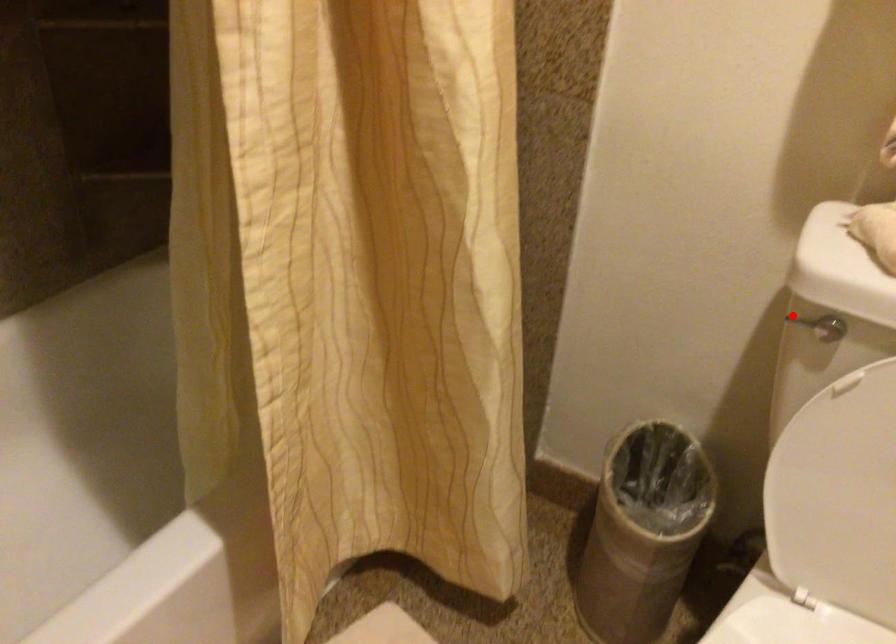
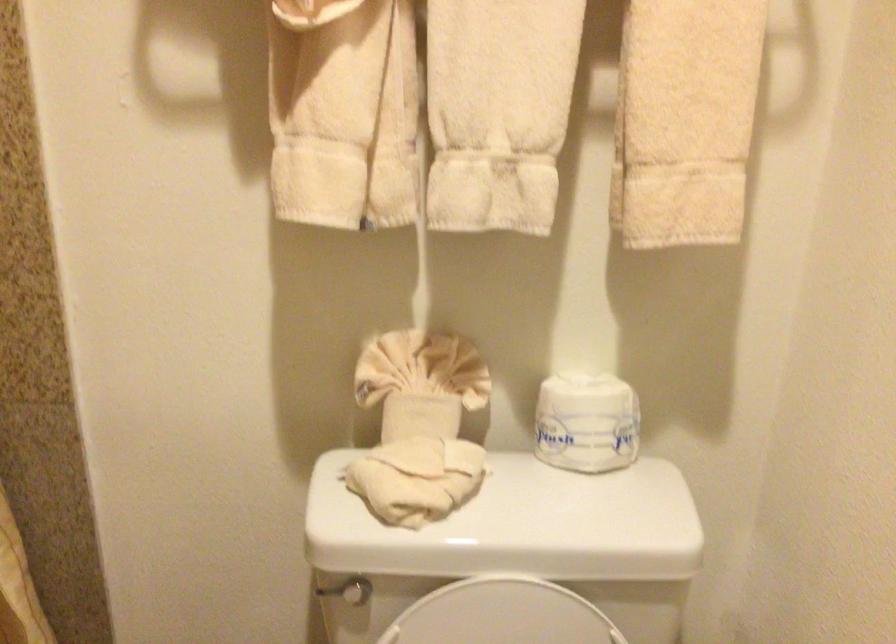
Where in the second image is the point corresponding to the highlighted location from the first image?

(326, 590)